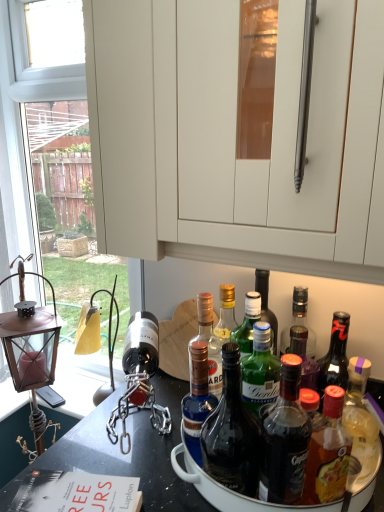
Describe the element at coordinates (285, 439) in the screenshot. I see `translucent glass bottle at center, which is the 2th bottle from right to left` at that location.

What do you see at coordinates (31, 352) in the screenshot?
I see `bronze lantern at left` at bounding box center [31, 352].

This screenshot has height=512, width=384. Identify the location of translucent glass bottle at center, the third bottle from the right. pos(231,433).

Identify the location of blue glass bottle at center, which is the 1th bottle from left to right. The height and width of the screenshot is (512, 384). (197, 391).

Describe the element at coordinates (197, 391) in the screenshot. I see `blue glass bottle at center, which appears as the 5th bottle when viewed from the right` at that location.

How much space does translucent plastic bottle at lower right, which is counted as the first bottle, starting from the right, occupy horizontally?

The width of translucent plastic bottle at lower right, which is counted as the first bottle, starting from the right, is 2.42 inches.

Identify the location of translucent glass bottle at center, which is the 2th bottle from right to left. The width and height of the screenshot is (384, 512). (285, 439).

Which point is more distant from viewer, (x=206, y=410) or (x=41, y=357)?

The point (x=41, y=357) is farther.

Considering the relative sizes of blue glass bottle at center, which is the 1th bottle from left to right, and bronze lantern at left in the image provided, is blue glass bottle at center, which is the 1th bottle from left to right, shorter than bronze lantern at left?

Yes.

From the picture: From the image's perspective, is blue glass bottle at center, which is the 1th bottle from left to right, located above bronze lantern at left?

Incorrect, from the image's perspective, blue glass bottle at center, which is the 1th bottle from left to right, is lower than bronze lantern at left.

Consider the image. Between translucent glass bottle at center, the third bottle from the right, and blue glass bottle at center, acting as the fourth bottle starting from the right, which one has smaller size?

With smaller size is blue glass bottle at center, acting as the fourth bottle starting from the right.

Is translucent glass bottle at center, the third bottle in the left-to-right sequence, positioned beyond the bounds of blue glass bottle at center, the 2th bottle when ordered from left to right?

translucent glass bottle at center, the third bottle in the left-to-right sequence, lies outside blue glass bottle at center, the 2th bottle when ordered from left to right,'s area.

Which point is more forward, [251,425] or [218,361]?

The point [251,425] is more forward.

Is point (279, 498) closer or farther from the camera than point (207, 360)?

Clearly, point (279, 498) is closer to the camera than point (207, 360).

Who is taller, translucent glass bottle at center, which appears as the fourth bottle when viewed from the left, or blue glass bottle at center, which appears as the 5th bottle when viewed from the right?

With more height is translucent glass bottle at center, which appears as the fourth bottle when viewed from the left.

Who is smaller, translucent glass bottle at center, which appears as the fourth bottle when viewed from the left, or blue glass bottle at center, which appears as the 5th bottle when viewed from the right?

With smaller size is blue glass bottle at center, which appears as the 5th bottle when viewed from the right.

Would you say translucent glass bottle at center, the third bottle from the right, is inside or outside translucent glass bottle at center, which is the 2th bottle from right to left?

translucent glass bottle at center, the third bottle from the right, is not enclosed by translucent glass bottle at center, which is the 2th bottle from right to left.

From a real-world perspective, starting from the translucent glass bottle at center, which appears as the fourth bottle when viewed from the left, which bottle is the 1st one below it? Please provide its 2D coordinates.

[(231, 433)]

Is translucent glass bottle at center, the third bottle in the left-to-right sequence, wider or thinner than translucent glass bottle at center, which appears as the fourth bottle when viewed from the left?

Considering their sizes, translucent glass bottle at center, the third bottle in the left-to-right sequence, looks slimmer than translucent glass bottle at center, which appears as the fourth bottle when viewed from the left.

Is translucent plastic bottle at lower right, which is counted as the first bottle, starting from the right, wider or thinner than blue glass bottle at center, which appears as the 5th bottle when viewed from the right?

translucent plastic bottle at lower right, which is counted as the first bottle, starting from the right, is wider than blue glass bottle at center, which appears as the 5th bottle when viewed from the right.

Is translucent plastic bottle at lower right, which is counted as the first bottle, starting from the right, far away from blue glass bottle at center, which appears as the 5th bottle when viewed from the right?

No, translucent plastic bottle at lower right, which is counted as the first bottle, starting from the right, is not far away from blue glass bottle at center, which appears as the 5th bottle when viewed from the right.

Is the depth of translucent plastic bottle at lower right, which is counted as the first bottle, starting from the right, less than that of blue glass bottle at center, which is the 1th bottle from left to right?

Yes, it is in front of blue glass bottle at center, which is the 1th bottle from left to right.

From a real-world perspective, is translucent plastic bottle at lower right, which is the fifth bottle from left to right, physically below blue glass bottle at center, which is the 1th bottle from left to right?

Correct, in the physical world, translucent plastic bottle at lower right, which is the fifth bottle from left to right, is lower than blue glass bottle at center, which is the 1th bottle from left to right.

Is bronze lantern at left wider than blue glass bottle at center, acting as the fourth bottle starting from the right?

Yes.

Which is behind, bronze lantern at left or blue glass bottle at center, the 2th bottle when ordered from left to right?

bronze lantern at left is behind.

Can blue glass bottle at center, the 2th bottle when ordered from left to right, be found inside bronze lantern at left?

No, blue glass bottle at center, the 2th bottle when ordered from left to right, is not inside bronze lantern at left.

From the image's perspective, which is below, bronze lantern at left or blue glass bottle at center, acting as the fourth bottle starting from the right?

bronze lantern at left.

Is blue glass bottle at center, the 2th bottle when ordered from left to right, looking in the opposite direction of translucent plastic bottle at lower right, which is counted as the first bottle, starting from the right?

No, blue glass bottle at center, the 2th bottle when ordered from left to right, is not facing away from translucent plastic bottle at lower right, which is counted as the first bottle, starting from the right.

Can you tell me how much blue glass bottle at center, the 2th bottle when ordered from left to right, and translucent plastic bottle at lower right, which is the fifth bottle from left to right, differ in facing direction?

The facing directions of blue glass bottle at center, the 2th bottle when ordered from left to right, and translucent plastic bottle at lower right, which is the fifth bottle from left to right, are 0.00621 degrees apart.

You are a GUI agent. You are given a task and a screenshot of the screen. Output one action in this format:
    pyautogui.click(x=<x>, y=<y>)
    Task: Click on the 3rd bottle to the right when counting from the blue glass bottle at center, the 2th bottle when ordered from left to right
    
    Given the screenshot: What is the action you would take?
    pyautogui.click(x=328, y=452)

The image size is (384, 512). I want to click on bottle that is the 2nd object above the bronze lantern at left (from a real-world perspective), so click(x=197, y=391).

Starting from the translucent glass bottle at center, the third bottle from the right, which bottle is the 1st one to the left? Please provide its 2D coordinates.

[(208, 344)]

Looking at the image, which one is located closer to blue glass bottle at center, which is the 1th bottle from left to right, bronze lantern at left or translucent plastic bottle at lower right, which is counted as the first bottle, starting from the right?

The object closer to blue glass bottle at center, which is the 1th bottle from left to right, is translucent plastic bottle at lower right, which is counted as the first bottle, starting from the right.

From the image, which object appears to be farther from blue glass bottle at center, acting as the fourth bottle starting from the right, blue glass bottle at center, which appears as the 5th bottle when viewed from the right, or bronze lantern at left?

bronze lantern at left is positioned further to the anchor blue glass bottle at center, acting as the fourth bottle starting from the right.

When comparing their distances from bronze lantern at left, does translucent glass bottle at center, which is the 2th bottle from right to left, or blue glass bottle at center, acting as the fourth bottle starting from the right, seem further?

translucent glass bottle at center, which is the 2th bottle from right to left, is positioned further to the anchor bronze lantern at left.

When comparing their distances from blue glass bottle at center, which is the 1th bottle from left to right, does translucent glass bottle at center, which is the 2th bottle from right to left, or bronze lantern at left seem closer?

translucent glass bottle at center, which is the 2th bottle from right to left.

When comparing their distances from bronze lantern at left, does translucent glass bottle at center, the third bottle from the right, or translucent plastic bottle at lower right, which is the fifth bottle from left to right, seem closer?

translucent glass bottle at center, the third bottle from the right, lies closer to bronze lantern at left than the other object.

Estimate the real-world distances between objects in this image. Which object is further from blue glass bottle at center, which appears as the 5th bottle when viewed from the right, blue glass bottle at center, acting as the fourth bottle starting from the right, or translucent glass bottle at center, the third bottle in the left-to-right sequence?

translucent glass bottle at center, the third bottle in the left-to-right sequence, is further to blue glass bottle at center, which appears as the 5th bottle when viewed from the right.

From the image, which object appears to be farther from translucent glass bottle at center, the third bottle in the left-to-right sequence, blue glass bottle at center, the 2th bottle when ordered from left to right, or blue glass bottle at center, which is the 1th bottle from left to right?

blue glass bottle at center, the 2th bottle when ordered from left to right.

Consider the image. Looking at the image, which one is located closer to blue glass bottle at center, acting as the fourth bottle starting from the right, translucent glass bottle at center, which is the 2th bottle from right to left, or translucent plastic bottle at lower right, which is the fifth bottle from left to right?

Based on the image, translucent glass bottle at center, which is the 2th bottle from right to left, appears to be nearer to blue glass bottle at center, acting as the fourth bottle starting from the right.

I want to click on bottle between translucent glass bottle at center, the third bottle in the left-to-right sequence, and blue glass bottle at center, the 2th bottle when ordered from left to right, along the z-axis, so click(x=197, y=391).

I want to click on bottle located between bronze lantern at left and blue glass bottle at center, acting as the fourth bottle starting from the right, in the left-right direction, so click(x=197, y=391).

Where is `bottle between translucent glass bottle at center, the third bottle in the left-to-right sequence, and translucent plastic bottle at lower right, which is counted as the first bottle, starting from the right, in the horizontal direction`? bottle between translucent glass bottle at center, the third bottle in the left-to-right sequence, and translucent plastic bottle at lower right, which is counted as the first bottle, starting from the right, in the horizontal direction is located at coordinates (285, 439).